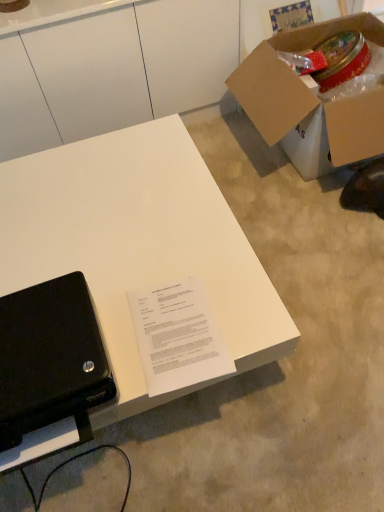
Where is `vacant position to the left of white paper at center`? The image size is (384, 512). vacant position to the left of white paper at center is located at coordinates (112, 334).